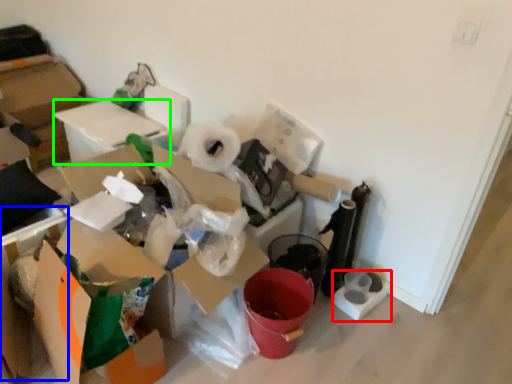
Question: Considering the real-world distances, which object is closest to toilet paper (highlighted by a red box)? cardboard box (highlighted by a blue box) or cardboard box (highlighted by a green box).

Choices:
 (A) cardboard box
 (B) cardboard box

Answer: (A)